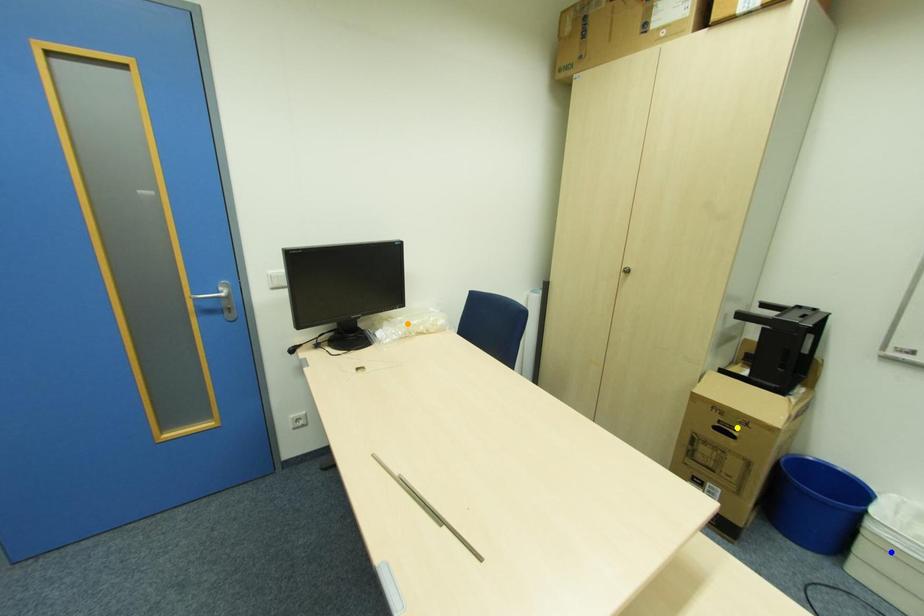
Order these from nearest to farthest:
A) orange point
B) blue point
C) yellow point

blue point
yellow point
orange point